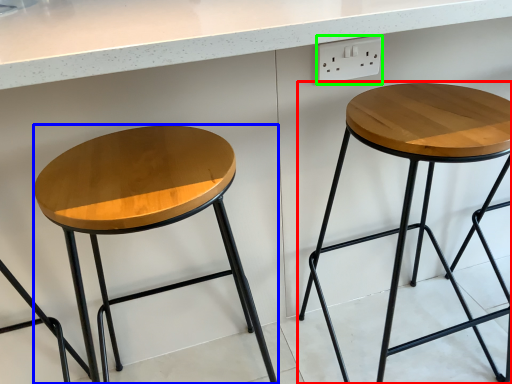
Question: Which object is positioned farthest from stool (highlighted by a red box)? Select from stool (highlighted by a blue box) and electric outlet (highlighted by a green box).

Choices:
 (A) stool
 (B) electric outlet

Answer: (A)